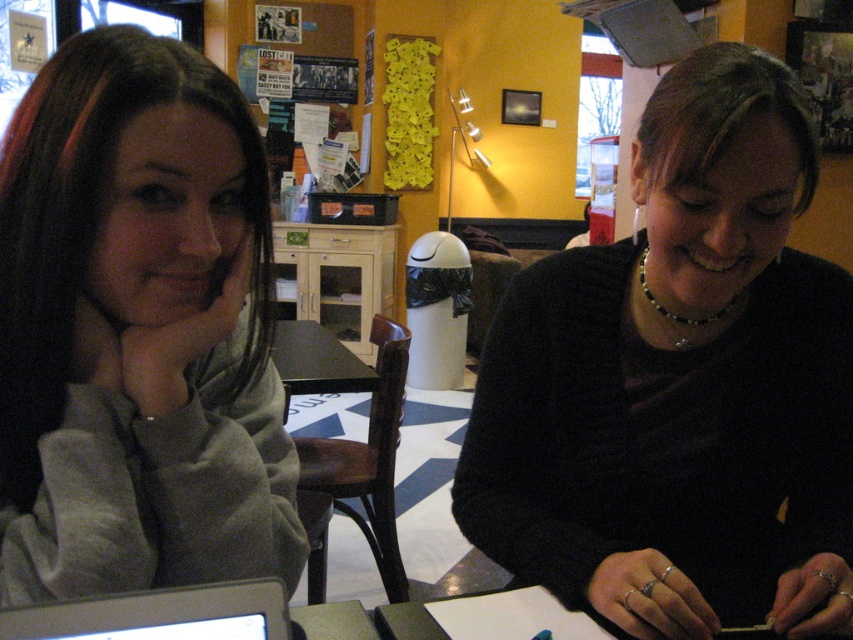
Question: Which of the following is the farthest from the observer?

Choices:
 (A) gray fleece at left
 (B) black matte sweater at center

Answer: (B)

Question: Which point appears closest to the camera in this image?

Choices:
 (A) (45, 124)
 (B) (33, 618)

Answer: (B)

Question: Is gray fleece at left thinner than silver metallic laptop at lower left?

Choices:
 (A) yes
 (B) no

Answer: (B)

Question: Can you confirm if black matte sweater at center is positioned to the right of silver metallic laptop at lower left?

Choices:
 (A) no
 (B) yes

Answer: (B)

Question: Can you confirm if gray fleece at left is thinner than silver metallic laptop at lower left?

Choices:
 (A) no
 (B) yes

Answer: (A)

Question: Which of the following is the closest to the observer?

Choices:
 (A) black matte sweater at center
 (B) silver metallic laptop at lower left

Answer: (B)